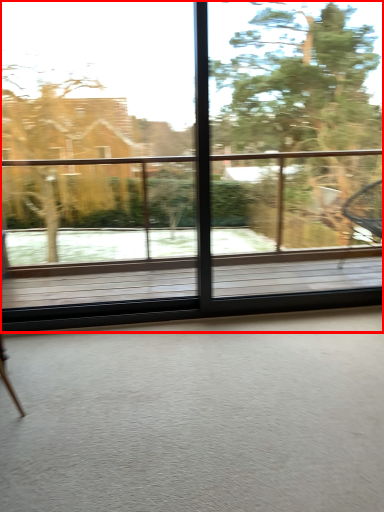
Question: In this image, where is window (annotated by the red box) located relative to tree?

Choices:
 (A) right
 (B) left

Answer: (B)